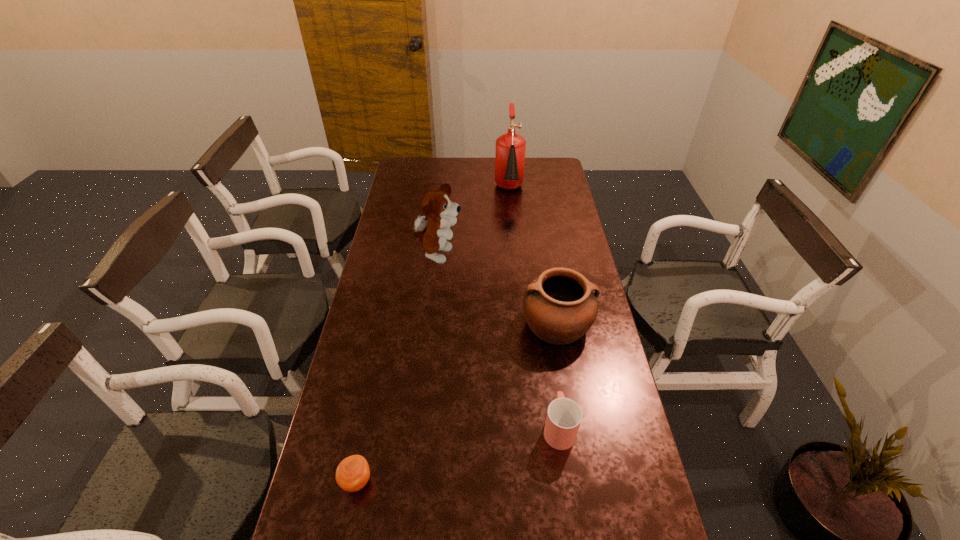
Identify the location of pottery located in the right edge section of the desktop. (560, 306).

Locate an element on the screen. The height and width of the screenshot is (540, 960). cup present at the right edge is located at coordinates (564, 416).

Image resolution: width=960 pixels, height=540 pixels. I want to click on vacant space at the far edge, so click(x=482, y=173).

Where is `blank space at the left edge of the desktop`? The height and width of the screenshot is (540, 960). blank space at the left edge of the desktop is located at coordinates (363, 456).

Find the location of a particular element. The height and width of the screenshot is (540, 960). vacant space at the right edge of the desktop is located at coordinates (567, 237).

This screenshot has width=960, height=540. In order to click on vacant space at the far right corner of the desktop in this screenshot , I will do `click(558, 160)`.

At what (x,y) coordinates should I click in order to perform the action: click on free space between the second object from left to right and the tallest object. Please return your answer as a coordinate pair (x, y). This screenshot has height=540, width=960. Looking at the image, I should click on (473, 223).

The height and width of the screenshot is (540, 960). What are the coordinates of `empty location between the pottery and the fire extinguisher` in the screenshot? It's located at point(533,258).

The image size is (960, 540). In order to click on vacant area that lies between the orange and the fourth farthest object in this screenshot , I will do `click(458, 454)`.

Where is `free space between the tallest object and the puppy`? This screenshot has height=540, width=960. free space between the tallest object and the puppy is located at coordinates point(473,223).